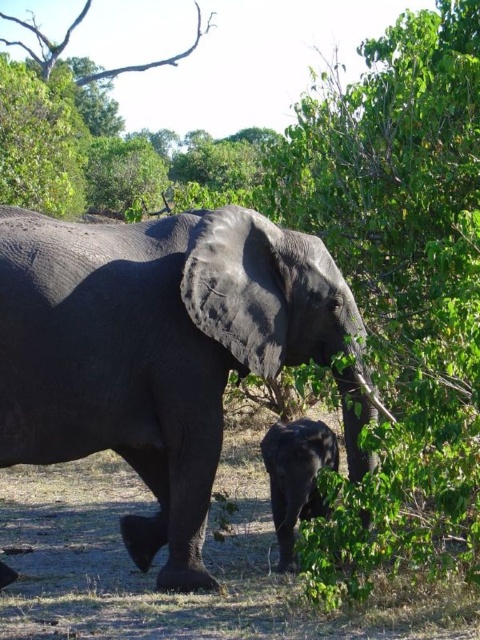
Question: Among these points, which one is farthest from the camera?

Choices:
 (A) tap(288, 634)
 (B) tap(23, 408)
 (C) tap(274, 442)

Answer: (C)

Question: Is brown dry grass at lower center wider than dark gray elephant at lower center?

Choices:
 (A) yes
 (B) no

Answer: (A)

Question: Which point is closer to the camera taking this photo?

Choices:
 (A) (287, 451)
 (B) (184, 228)
 (C) (430, 593)

Answer: (C)

Question: Which object is farther from the camera taking this photo?

Choices:
 (A) gray textured elephant at center
 (B) brown dry grass at lower center
 (C) dark gray elephant at lower center

Answer: (B)

Question: Observing the image, what is the correct spatial positioning of brown dry grass at lower center in reference to dark gray elephant at lower center?

Choices:
 (A) above
 (B) below

Answer: (B)

Question: Observing the image, what is the correct spatial positioning of gray textured elephant at center in reference to brown dry grass at lower center?

Choices:
 (A) above
 (B) below

Answer: (A)